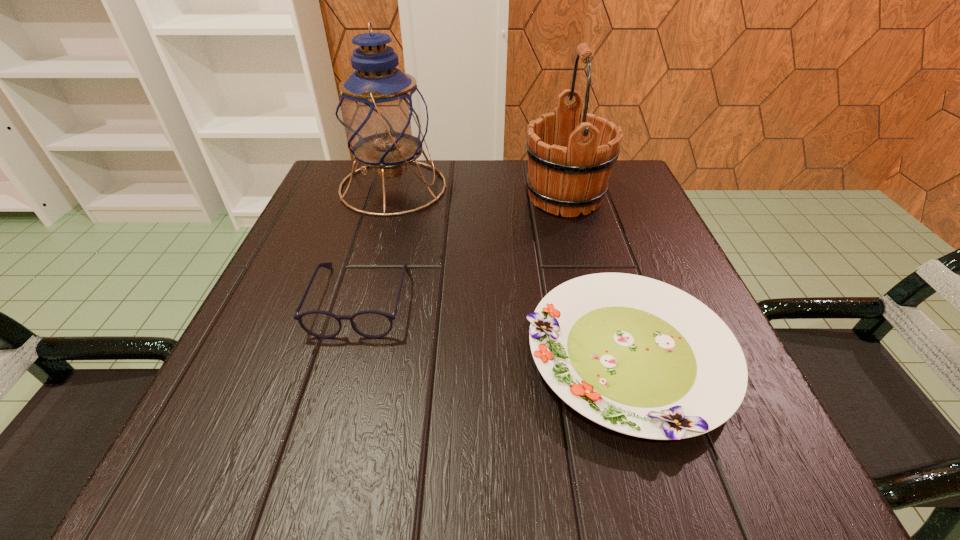
Where is `vacant point located between the lantern and the salad plate`? The image size is (960, 540). vacant point located between the lantern and the salad plate is located at coordinates (511, 272).

This screenshot has width=960, height=540. I want to click on free space that is in between the lantern and the shortest object, so click(x=511, y=272).

Find the location of a particular element. This screenshot has height=540, width=960. blank region between the wine bucket and the second shortest object is located at coordinates (463, 248).

Locate an element on the screen. free space between the wine bucket and the lantern is located at coordinates pos(479,192).

Point out which object is positioned as the second nearest to the wine bucket. Please provide its 2D coordinates. Your answer should be formatted as a tuple, i.e. [(x, y)], where the tuple contains the x and y coordinates of a point satisfying the conditions above.

[(636, 355)]

Select which object is the closest to the shortest object. Please provide its 2D coordinates. Your answer should be formatted as a tuple, i.e. [(x, y)], where the tuple contains the x and y coordinates of a point satisfying the conditions above.

[(569, 162)]

Where is `vacant region that satisfies the following two spatial constraints: 1. on the back side of the salad plate; 2. on the front-facing side of the lantern`? vacant region that satisfies the following two spatial constraints: 1. on the back side of the salad plate; 2. on the front-facing side of the lantern is located at coordinates (576, 187).

In order to click on free space that satisfies the following two spatial constraints: 1. on the front-facing side of the shortest object; 2. on the left side of the lantern in this screenshot , I will do `click(346, 357)`.

This screenshot has width=960, height=540. I want to click on vacant space that satisfies the following two spatial constraints: 1. on the front side of the salad plate; 2. on the left side of the wine bucket, so click(x=607, y=357).

The image size is (960, 540). Identify the location of free location that satisfies the following two spatial constraints: 1. on the front-facing side of the wine bucket; 2. on the left side of the lantern. (390, 198).